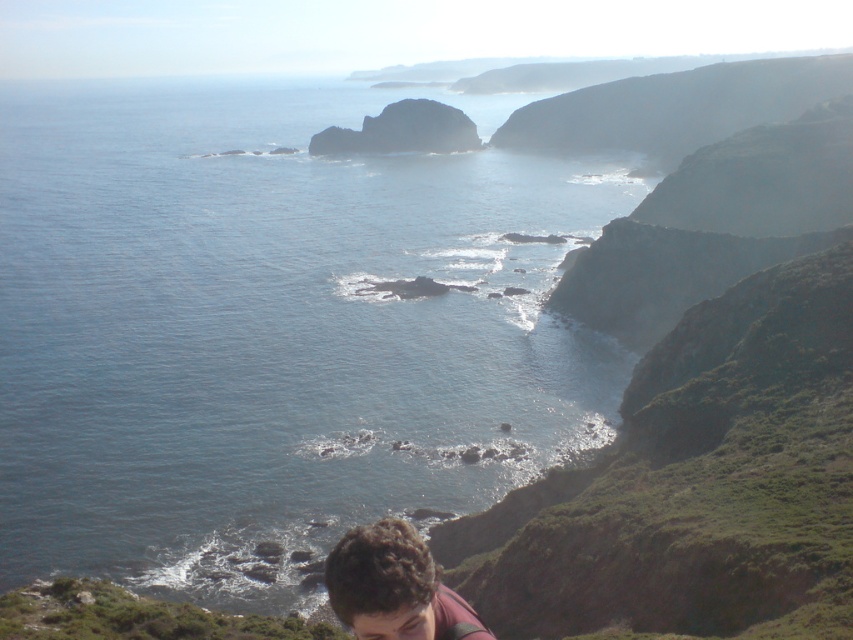
Question: Which point is farther from the camera taking this photo?

Choices:
 (A) (383, 520)
 (B) (480, 125)

Answer: (B)

Question: Does blue water at center have a lesser width compared to brown curly hair at lower center?

Choices:
 (A) no
 (B) yes

Answer: (A)

Question: Is blue water at center closer to the viewer compared to brown curly hair at lower center?

Choices:
 (A) yes
 (B) no

Answer: (B)

Question: Does blue water at center appear under brown curly hair at lower center?

Choices:
 (A) no
 (B) yes

Answer: (A)

Question: Which point is closer to the camera taking this photo?

Choices:
 (A) (364, 616)
 (B) (194, 140)

Answer: (A)